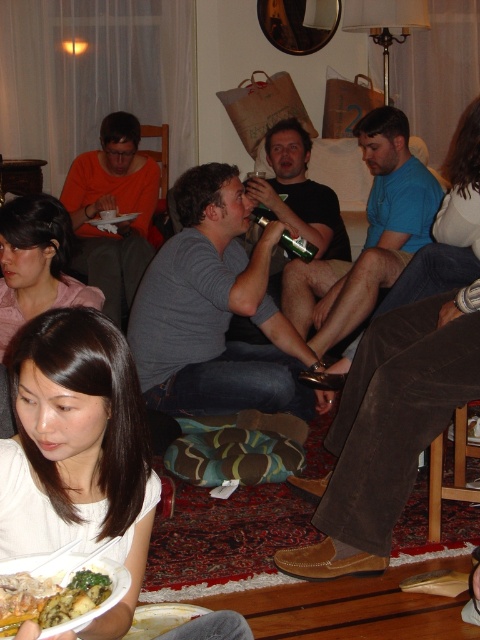
Is the position of green leafy vegetables at lower left more distant than that of green glass bottle at center?

No.

In the scene shown: Who is shorter, green leafy vegetables at lower left or green glass bottle at center?

With less height is green leafy vegetables at lower left.

This screenshot has width=480, height=640. Find the location of `green leafy vegetables at lower left`. green leafy vegetables at lower left is located at coordinates (48, 598).

The width and height of the screenshot is (480, 640). Find the location of `green leafy vegetables at lower left`. green leafy vegetables at lower left is located at coordinates (48, 598).

Who is shorter, pink fabric shirt at lower left or green glass bottle at center?

With less height is green glass bottle at center.

Is point (48, 307) positioned behind point (288, 230)?

No, it is in front of (288, 230).

Where is `pink fabric shirt at lower left`? pink fabric shirt at lower left is located at coordinates (36, 262).

Does pink fabric shirt at lower left appear on the right side of green leafy vegetables at lower left?

In fact, pink fabric shirt at lower left is to the left of green leafy vegetables at lower left.

What do you see at coordinates (36, 262) in the screenshot? I see `pink fabric shirt at lower left` at bounding box center [36, 262].

Between point (36, 269) and point (24, 604), which one is positioned behind?

Point (36, 269)

At what (x,y) coordinates should I click in order to perform the action: click on pink fabric shirt at lower left. Please return your answer as a coordinate pair (x, y). Looking at the image, I should click on (36, 262).